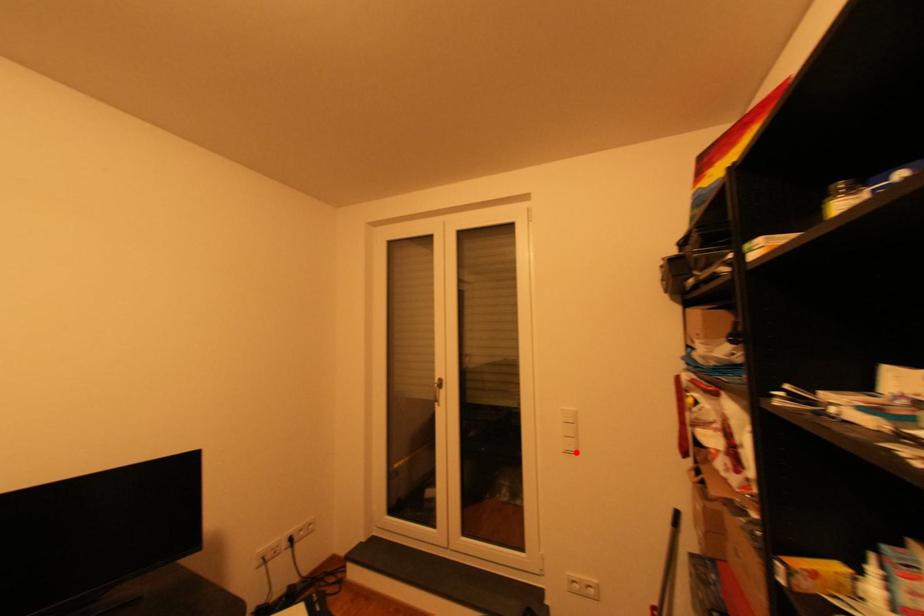
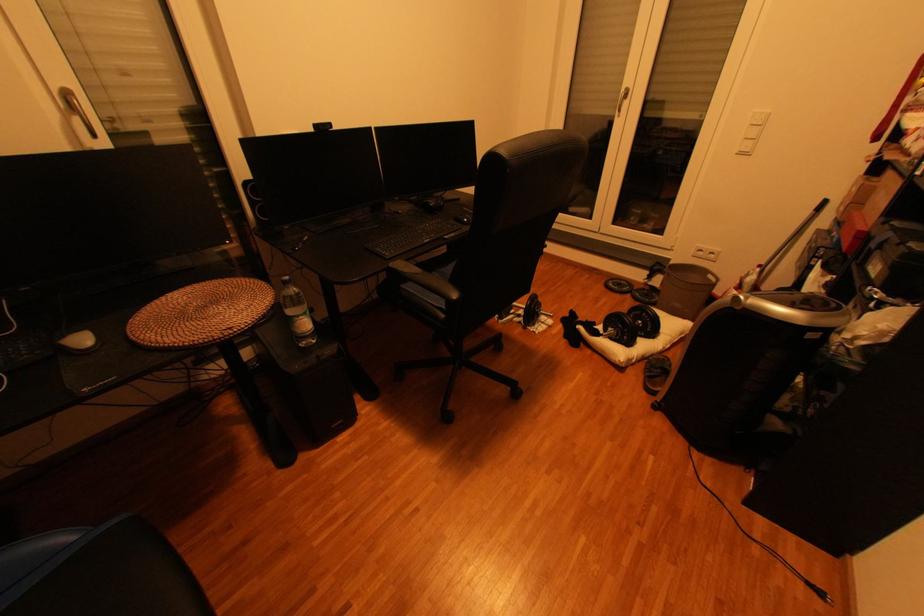
The point at the highlighted location is marked in the first image. Where is the corresponding point in the second image?

(749, 155)